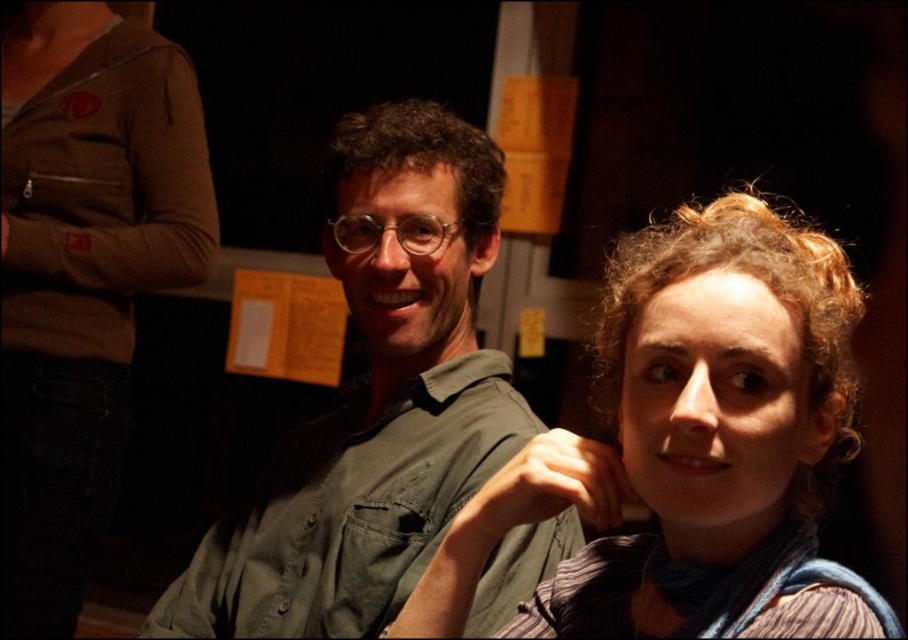
You are a photographer standing 10 feet away from the green matte shirt at center. You want to take a photo of the shirt while also capturing the entire scene in the background. Will the shirt be in focus if you set the camera to have a depth of field that can sharply focus on objects within 10 inches of the current focus point?

The shirt is 32.50 inches away from the photographer. The depth of field can only sharply focus within 10 inches of the focus point. If the photographer focuses on the shirt, the background may be blurry. If focusing on the background, the shirt might be out of focus. To capture both, adjust focus closer to the midpoint or use a smaller aperture for greater depth of field.

You are a photographer trying to capture a closeup shot of both the curly hair at center and the brown zippered jacket at upper left. Based on their sizes, which object would require you to move closer to get a detailed shot?

The curly hair at center has a lesser width compared to the brown zippered jacket at upper left, so you would need to move closer to the curly hair at center to capture its details in the closeup shot.

You are standing in the room and want to take a photo of the two people seated closely together. If you move 12 inches closer to the point at coordinates point (x=400, y=278), will you be within 30 inches of them?

The point at coordinates point (x=400, y=278) is currently 39.14 inches away from you. If you move 12 inches closer, your new distance would be 39.14 minus 12, which equals 27.14 inches. Since 27.14 is less than 30, you would be within 30 inches of them.